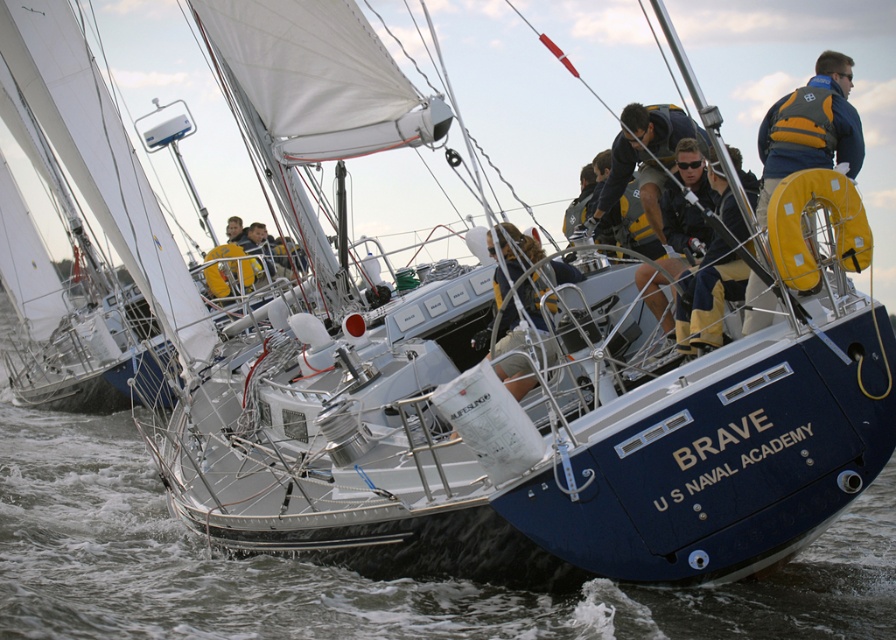
Consider the image. You are a sailor preparing for a sudden storm and need to choose between the yellow life vest at center and the yellow life jacket at center. Which one should you choose based on their sizes?

The yellow life vest at center has a larger size compared to the yellow life jacket at center, so you should choose the yellow life vest at center for better buoyancy and safety during the storm.

You are a sailor on the BRAVE sailboat and need to retrieve an item that fell into the water at the clear water at lower center. The item is floating 11.18 meters away from the boat. If the boat can travel at a maximum speed of 10 knots, how many minutes will it take to reach the item?

The item is 11.18 meters away from the boat. Since the boat can travel at a maximum speed of 10 knots, converting knots to meters per minute, 10 knots is approximately 18.52 meters per minute. To find the time, divide the distance by speed. 11.18 meters divided by 18.52 meters per minute equals approximately 0.604 minutes, which is about 36.24 seconds. Therefore, it will take roughly 36 seconds to reach the item.